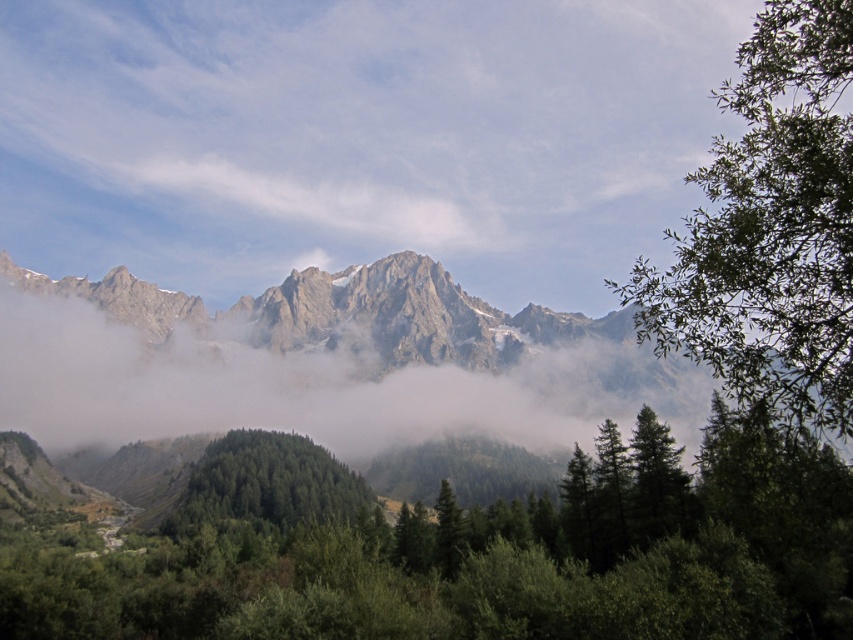
You are standing in the mountain landscape and want to walk from point A to point B. Point A is at coordinate point (300, 209) and point B is at coordinate point (332, 516). Which point is closer to you when you start walking?

Point A at coordinate point (300, 209) is closer to you because it is further to the viewer than point B at coordinate point (332, 516), so you will reach it first.